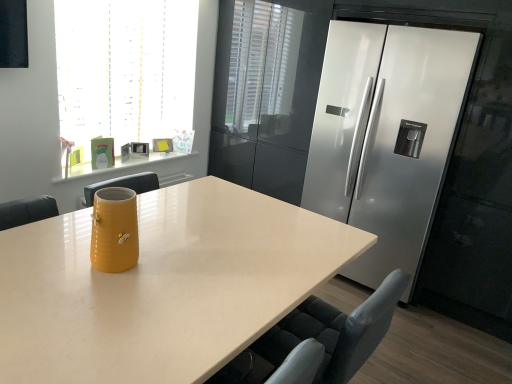
Question: From the image's perspective, is matte yellow vase at center over yellow matte mug at upper left?

Choices:
 (A) no
 (B) yes

Answer: (A)

Question: Considering the relative sizes of matte yellow vase at center and yellow matte mug at upper left in the image provided, is matte yellow vase at center thinner than yellow matte mug at upper left?

Choices:
 (A) no
 (B) yes

Answer: (A)

Question: Is matte yellow vase at center at the right side of yellow matte mug at upper left?

Choices:
 (A) yes
 (B) no

Answer: (A)

Question: Would you say matte yellow vase at center is a long distance from yellow matte mug at upper left?

Choices:
 (A) yes
 (B) no

Answer: (A)

Question: Is matte yellow vase at center not inside yellow matte mug at upper left?

Choices:
 (A) no
 (B) yes

Answer: (B)

Question: Looking at their shapes, would you say matte yellow vase at center is wider or thinner than translucent glass window at upper left?

Choices:
 (A) wide
 (B) thin

Answer: (A)

Question: Is point (157, 367) closer or farther from the camera than point (182, 13)?

Choices:
 (A) closer
 (B) farther

Answer: (A)

Question: Visually, is matte yellow vase at center positioned to the left or to the right of translucent glass window at upper left?

Choices:
 (A) left
 (B) right

Answer: (B)

Question: From a real-world perspective, is matte yellow vase at center above or below translucent glass window at upper left?

Choices:
 (A) above
 (B) below

Answer: (B)

Question: Choose the correct answer: Is yellow ceramic vase at center inside matte yellow vase at center or outside it?

Choices:
 (A) inside
 (B) outside

Answer: (B)

Question: In the image, is yellow ceramic vase at center positioned in front of or behind matte yellow vase at center?

Choices:
 (A) behind
 (B) front

Answer: (A)

Question: In terms of height, does yellow ceramic vase at center look taller or shorter compared to matte yellow vase at center?

Choices:
 (A) short
 (B) tall

Answer: (A)

Question: Considering the positions of yellow ceramic vase at center and matte yellow vase at center in the image, is yellow ceramic vase at center wider or thinner than matte yellow vase at center?

Choices:
 (A) thin
 (B) wide

Answer: (A)

Question: Considering the positions of point (92, 238) and point (404, 140), is point (92, 238) closer or farther from the camera than point (404, 140)?

Choices:
 (A) farther
 (B) closer

Answer: (B)

Question: In terms of width, does yellow ceramic vase at center look wider or thinner when compared to satin silver refrigerator at right?

Choices:
 (A) wide
 (B) thin

Answer: (B)